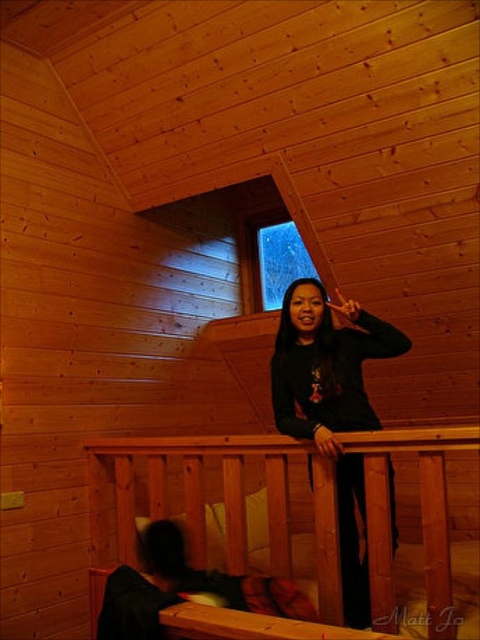
You are in a wooden cabin at night. You see a point labeled as point [204,500]. What object does this point correspond to?

The point [204,500] corresponds to the wooden rail at upper center.

Consider the image. You are in the wooden cabin and want to place a small nightlight between the two points, point (194,456) and point (384,336). Since the nightlight needs to be placed in front of the lower bunk where the person is lying, will the nightlight be visible to the person in the upper bunk?

Point (194,456) is behind point (384,336), so placing the nightlight between them would mean it is closer to point (384,336). Since the person in the upper bunk is at point (384,336), they would be able to see the nightlight if it is placed in front of the lower bunk.

Consider the image. You are inside the wooden cabin and want to place a small nightlight. You have two points to choose from, point [432,525] and point [288,278]. Which point is closer to you if you are standing at the entrance facing the interior?

Point [432,525] is closer to the viewer than point [288,278], so you should place the nightlight at point [432,525].